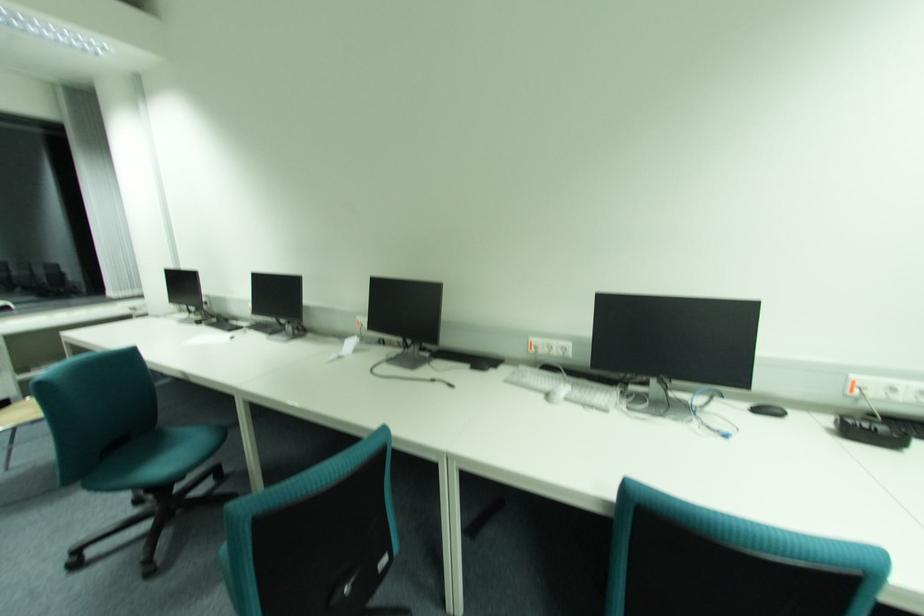
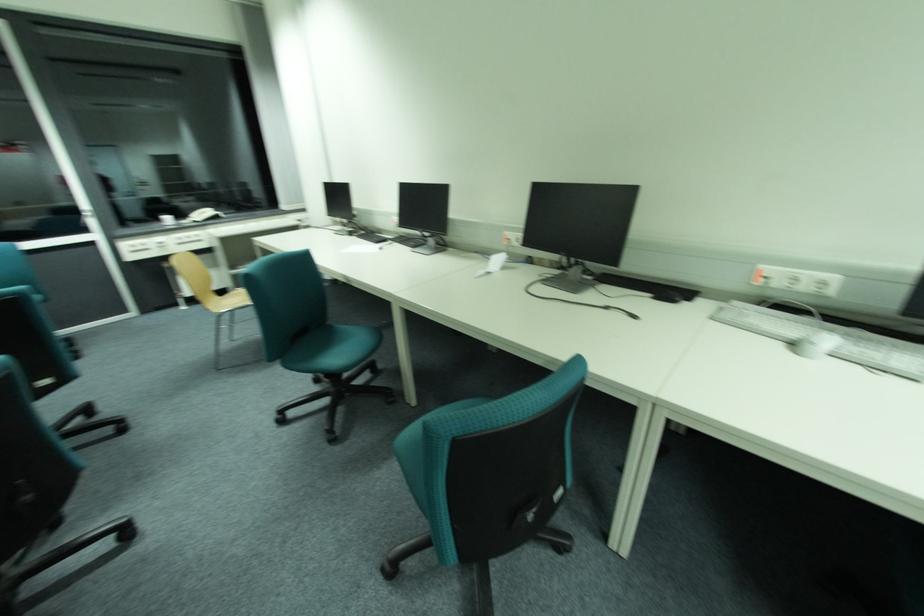
In the second image, find the point that corresponds to (x=528, y=368) in the first image.

(743, 304)